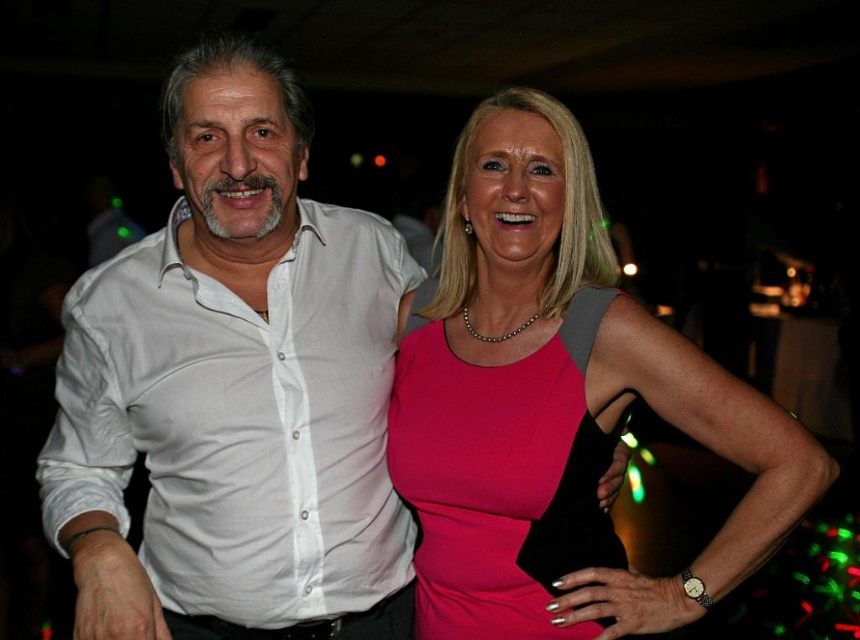
In the image, there are a white cotton shirt at left and a pink matte dress at center. Which one is positioned more to the left side?

The white cotton shirt at left is positioned more to the left side than the pink matte dress at center.

You are organizing a charity event and need to decide which outfit to wear based on the image. The venue has a narrow corridor leading to the stage. Which outfit between the white cotton shirt at left and the pink matte dress at center would be easier to move through the corridor without getting stuck?

The white cotton shirt at left is thinner than the pink matte dress at center, so it would be easier to move through the narrow corridor without getting stuck.